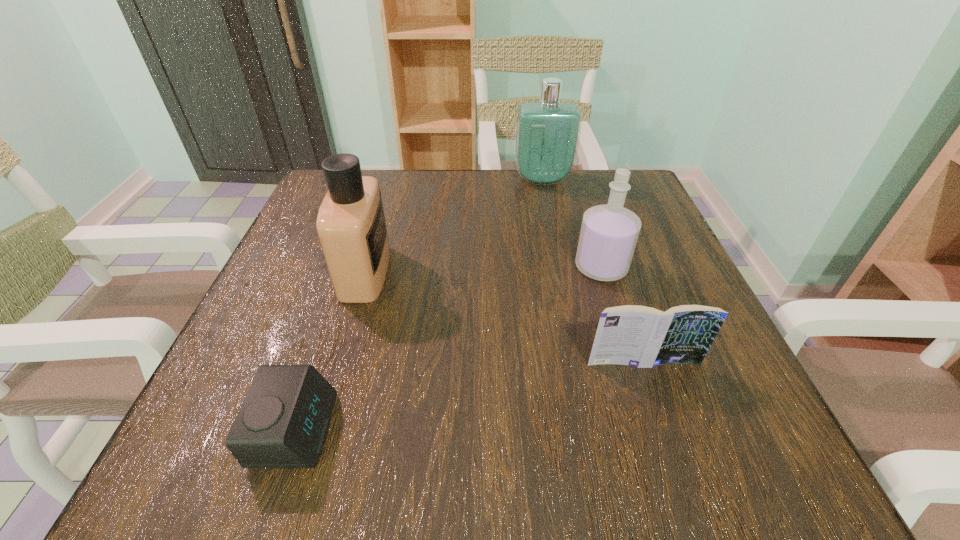
Find the location of a particular element. The image size is (960, 540). object present at the far edge is located at coordinates (547, 133).

Find the location of a particular element. object that is positioned at the near edge is located at coordinates [283, 422].

In order to click on perfume present at the left edge in this screenshot , I will do [351, 226].

The image size is (960, 540). What are the coordinates of `alarm clock that is positioned at the left edge` in the screenshot? It's located at (283, 422).

In order to click on perfume at the right edge in this screenshot , I will do `click(609, 232)`.

I want to click on book present at the right edge, so click(x=633, y=335).

The image size is (960, 540). I want to click on object that is at the near left corner, so click(x=283, y=422).

Identify the location of free space at the far edge of the desktop. The image size is (960, 540). (564, 222).

Locate an element on the screen. This screenshot has height=540, width=960. vacant space at the near edge is located at coordinates (313, 475).

I want to click on vacant space at the right edge of the desktop, so click(x=661, y=272).